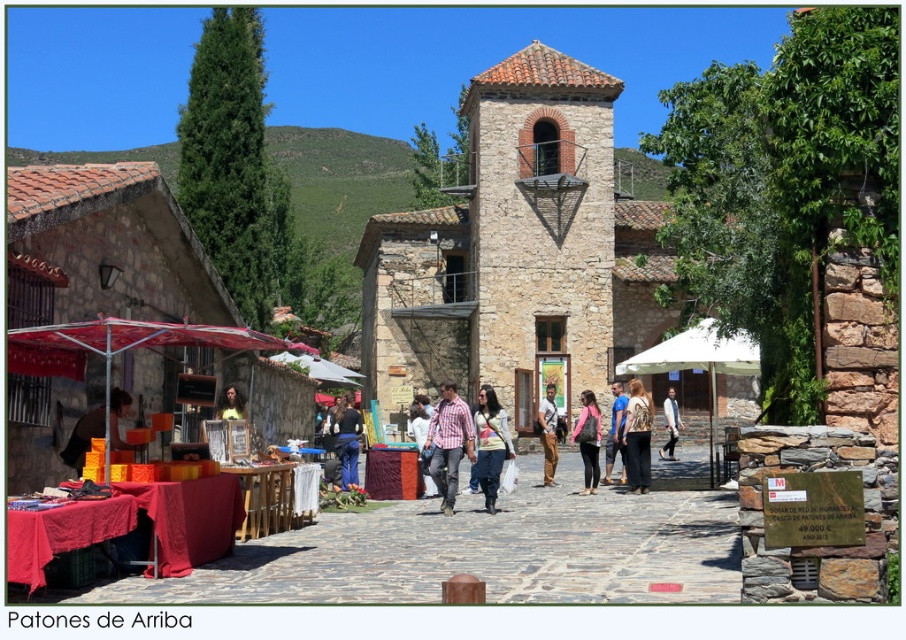
Consider the image. You are a traveler in Patones de Arriba village square. You see a matte red fabric stall at left and a light brown leather jacket at center. Which object is taller?

The matte red fabric stall at left is much taller than the light brown leather jacket at center.

You are standing in Patones de Arriba square and want to take a photo of the point at coordinates [467,426]. The camera you have can only focus on objects within 50 meters. Will the point be in focus?

The point at coordinates [467,426] is 57.48 meters away from the camera, which is beyond the camera focus range of 50 meters. Therefore, the point will not be in focus.

In the cobblestone square of Patones de Arriba, there are two clothing items displayed at the center of the market stall under a red canopy. The plaid cotton shirt at center and the denim jacket at center. Which one is positioned to the left?

The plaid cotton shirt at center is positioned to the left of the denim jacket at center.